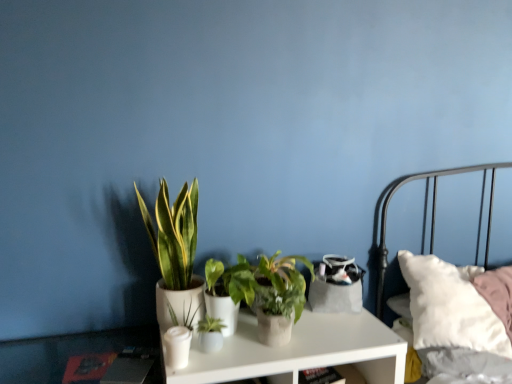
This screenshot has height=384, width=512. In order to click on vacant area that is in front of green matte plant at center, the 2th houseplant in the right-to-left sequence in this screenshot , I will do [x=224, y=364].